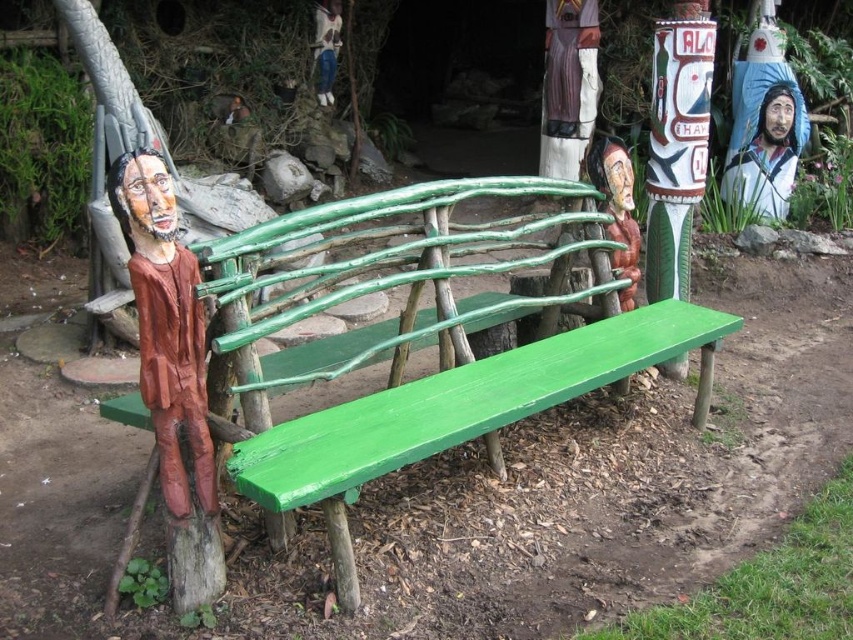
You are a painter who wants to ensure both the wooden figure at center and the brushed metal figure at upper center are visible in your painting. Given their sizes, which one should you make larger in your artwork to maintain their real proportions?

The brushed metal figure at upper center is taller than the wooden figure at center, so to maintain their real proportions, you should paint the brushed metal figure at upper center larger than the wooden figure at center.

You are planning to place a new decorative item between the wooden figure at center and the brushed metal figure at upper center. Based on their widths, which one should you place closer to the narrower figure to ensure proper spacing?

The wooden figure at center might be wider than the brushed metal figure at upper center, so you should place the new item closer to the brushed metal figure at upper center to maintain proper spacing.

You are an artist planning to place a new sculpture between the wooden figure at left and the wooden figure at center. Given their sizes, which existing figure should the new sculpture be closer to in order to maintain visual balance?

The wooden figure at left is larger in size than the wooden figure at center. To maintain visual balance, the new sculpture should be placed closer to the wooden figure at center since it is smaller.